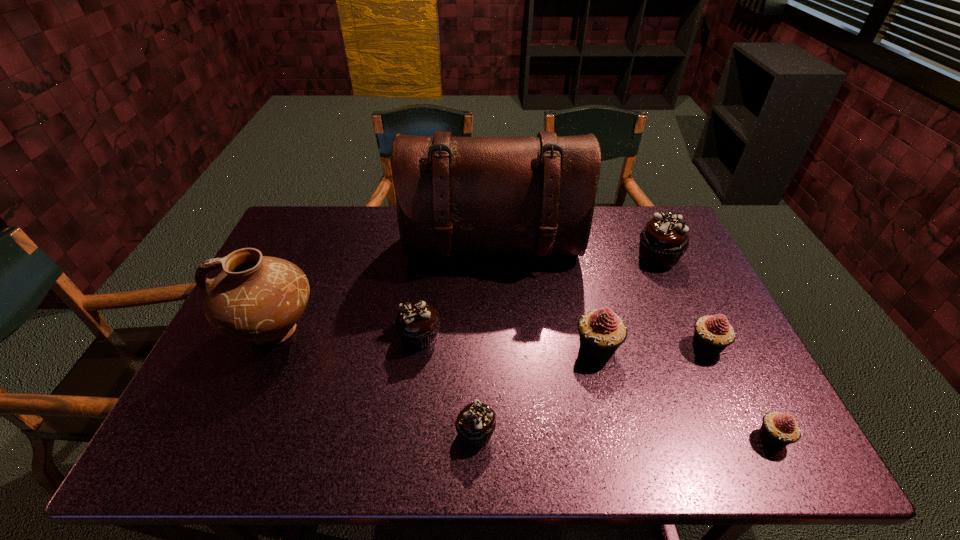
Where is `cupcake that stands as the fourth closest to the leftmost pink cupcake`? This screenshot has width=960, height=540. cupcake that stands as the fourth closest to the leftmost pink cupcake is located at coordinates (778, 430).

Where is `cupcake object that ranks as the third closest to the farthest cupcake`? Image resolution: width=960 pixels, height=540 pixels. cupcake object that ranks as the third closest to the farthest cupcake is located at coordinates (778, 430).

Locate which pink cupcake is the closest to the second tallest object. Please provide its 2D coordinates. Your answer should be formatted as a tuple, i.e. [(x, y)], where the tuple contains the x and y coordinates of a point satisfying the conditions above.

[(601, 332)]

Identify which pink cupcake is the second nearest to the nearest brown cupcake. Please provide its 2D coordinates. Your answer should be formatted as a tuple, i.e. [(x, y)], where the tuple contains the x and y coordinates of a point satisfying the conditions above.

[(712, 334)]

At what (x,y) coordinates should I click in order to perform the action: click on brown cupcake identified as the second closest to the satchel. Please return your answer as a coordinate pair (x, y). Image resolution: width=960 pixels, height=540 pixels. Looking at the image, I should click on click(664, 239).

The image size is (960, 540). In order to click on brown cupcake that is the third closest to the smallest pink cupcake in this screenshot , I will do `click(417, 323)`.

The width and height of the screenshot is (960, 540). I want to click on free location that satisfies the following two spatial constraints: 1. on the back side of the leftmost cupcake; 2. on the right side of the biggest brown cupcake, so click(x=430, y=257).

This screenshot has width=960, height=540. I want to click on free location that satisfies the following two spatial constraints: 1. on the front-facing side of the third cupcake from left to right; 2. on the right side of the satchel, so click(x=496, y=348).

Where is `free point that satisfies the following two spatial constraints: 1. on the front-facing side of the smallest pink cupcake; 2. on the right side of the satchel`? The width and height of the screenshot is (960, 540). free point that satisfies the following two spatial constraints: 1. on the front-facing side of the smallest pink cupcake; 2. on the right side of the satchel is located at coordinates (499, 438).